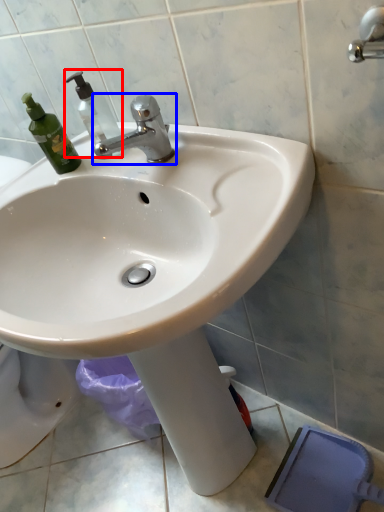
Question: Which object appears closest to the camera in this image, soap dispenser (highlighted by a red box) or tap (highlighted by a blue box)?

Choices:
 (A) soap dispenser
 (B) tap

Answer: (B)